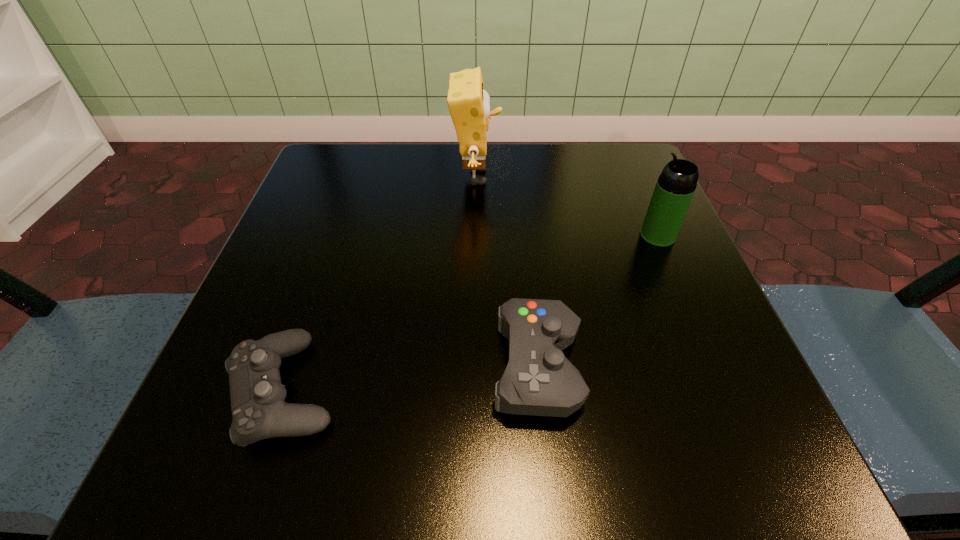
In the image, there is a desktop. At what (x,y) coordinates should I click in order to perform the action: click on vacant space at the far left corner. Please return your answer as a coordinate pair (x, y). This screenshot has width=960, height=540. Looking at the image, I should click on (373, 198).

Image resolution: width=960 pixels, height=540 pixels. In the image, there is a desktop. Find the location of `vacant space at the far right corner`. vacant space at the far right corner is located at coordinates (579, 154).

Identify the location of free space between the thermos bottle and the sponge. The width and height of the screenshot is (960, 540). (567, 206).

Where is `unoccupied position between the leftmost object and the third nearest object`? This screenshot has height=540, width=960. unoccupied position between the leftmost object and the third nearest object is located at coordinates (471, 313).

Locate an element on the screen. Image resolution: width=960 pixels, height=540 pixels. vacant space in between the leftmost object and the right control is located at coordinates (411, 378).

You are a GUI agent. You are given a task and a screenshot of the screen. Output one action in this format:
    pyautogui.click(x=<x>, y=<y>)
    Task: Click on the free space between the right control and the left control
    This screenshot has height=540, width=960.
    Given the screenshot: What is the action you would take?
    pyautogui.click(x=411, y=378)

Where is `vacant area that lies between the rightmost object and the leftmost object`? This screenshot has height=540, width=960. vacant area that lies between the rightmost object and the leftmost object is located at coordinates (471, 313).

You are a GUI agent. You are given a task and a screenshot of the screen. Output one action in this format:
    pyautogui.click(x=<x>, y=<y>)
    Task: Click on the unoccupied area between the farthest object and the left control
    The image size is (960, 540).
    Given the screenshot: What is the action you would take?
    pyautogui.click(x=380, y=283)

Where is `vacant space that's between the farthest object and the rightmost object`? The width and height of the screenshot is (960, 540). vacant space that's between the farthest object and the rightmost object is located at coordinates (567, 206).

This screenshot has height=540, width=960. In order to click on vacant space that is in between the right control and the tallest object in this screenshot , I will do `click(507, 272)`.